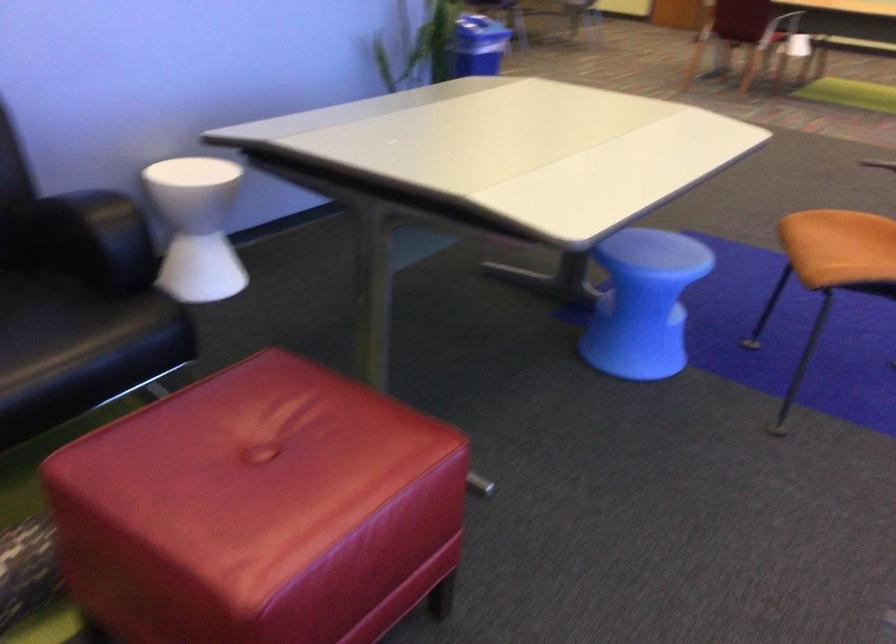
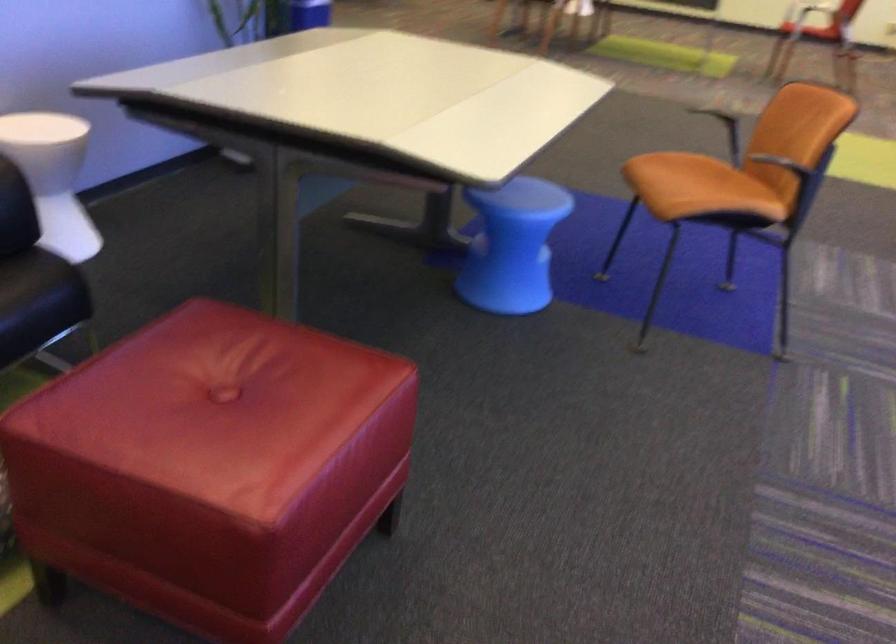
Where in the second image is the point corresponding to (194,220) from the first image?

(53, 176)